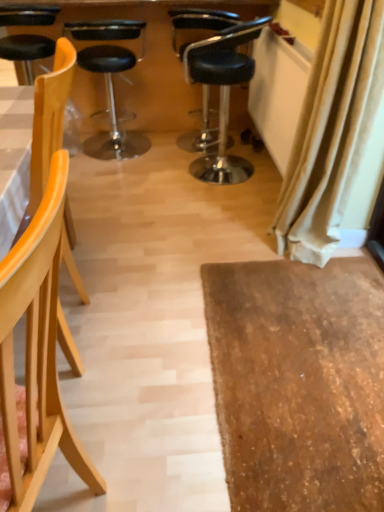
Question: In the image, is black leather chair at center, arranged as the 5th chair when viewed from the front, on the left side or the right side of light wood chair at left, acting as the 2th chair starting from the front?

Choices:
 (A) left
 (B) right

Answer: (B)

Question: Is black leather chair at center, arranged as the 5th chair when viewed from the front, inside or outside of light wood chair at left, the 4th chair viewed from the back?

Choices:
 (A) inside
 (B) outside

Answer: (B)

Question: Which of these objects is positioned closest to the black leather stool at center, the second chair when ordered from back to front?

Choices:
 (A) black leather chair at center, arranged as the 5th chair when viewed from the front
 (B) black leather stool at center, acting as the third chair starting from the front
 (C) black leather desk at upper center
 (D) light wood chair at left, acting as the 2th chair starting from the front
 (E) light wood chair at left, the 5th chair in the back-to-front sequence

Answer: (C)

Question: Which object is positioned closest to the light wood chair at left, acting as the 2th chair starting from the front?

Choices:
 (A) beige fabric curtain at right
 (B) black leather desk at upper center
 (C) light wood chair at left, the 5th chair in the back-to-front sequence
 (D) black leather stool at center, the fourth chair viewed from the front
 (E) black leather stool at center, acting as the third chair starting from the back

Answer: (C)